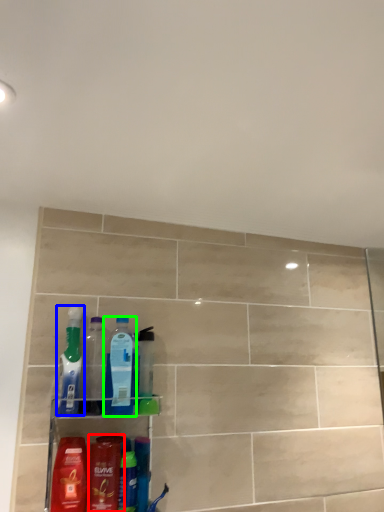
Question: Which object is positioned farthest from mouthwash (highlighted by a red box)? Select from cleaning product (highlighted by a blue box) and bottle (highlighted by a green box).

Choices:
 (A) cleaning product
 (B) bottle

Answer: (A)